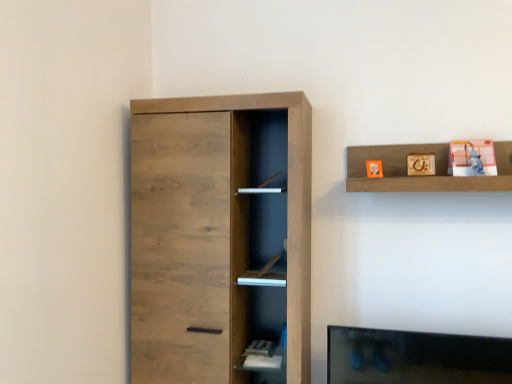
What do you see at coordinates (422, 176) in the screenshot? This screenshot has height=384, width=512. I see `wooden shelf at upper right` at bounding box center [422, 176].

You are a GUI agent. You are given a task and a screenshot of the screen. Output one action in this format:
    pyautogui.click(x=<x>, y=<y>)
    Task: Click on the natural wood cupboard at left
    This screenshot has height=384, width=512.
    Given the screenshot: What is the action you would take?
    pyautogui.click(x=209, y=236)

Is there a large distance between wooden shelf at upper right and matte plastic photo frame at upper right, positioned as the second toy in left-to-right order?

No, wooden shelf at upper right is in close proximity to matte plastic photo frame at upper right, positioned as the second toy in left-to-right order.

Is wooden shelf at upper right facing away from matte plastic photo frame at upper right, positioned as the second toy in left-to-right order?

That's right, wooden shelf at upper right is facing away from matte plastic photo frame at upper right, positioned as the second toy in left-to-right order.

Between wooden shelf at upper right and matte plastic photo frame at upper right, positioned as the second toy in left-to-right order, which one has larger width?

With larger width is wooden shelf at upper right.

Considering the relative sizes of wooden shelf at upper right and matte plastic photo frame at upper right, the first toy when ordered from right to left, in the image provided, is wooden shelf at upper right smaller than matte plastic photo frame at upper right, the first toy when ordered from right to left,?

No, wooden shelf at upper right is not smaller than matte plastic photo frame at upper right, the first toy when ordered from right to left.

From a real-world perspective, is natural wood cupboard at left physically below matte plastic photo frame at upper right, the first toy when ordered from right to left?

Yes, from a real-world perspective, natural wood cupboard at left is below matte plastic photo frame at upper right, the first toy when ordered from right to left.

Is natural wood cupboard at left completely or partially outside of matte plastic photo frame at upper right, the first toy when ordered from right to left?

natural wood cupboard at left lies outside matte plastic photo frame at upper right, the first toy when ordered from right to left,'s area.

Consider the image. Between natural wood cupboard at left and matte plastic photo frame at upper right, positioned as the second toy in left-to-right order, which one appears on the left side from the viewer's perspective?

Positioned to the left is natural wood cupboard at left.

Which object is further away from the camera taking this photo, natural wood cupboard at left or matte plastic photo frame at upper right, positioned as the second toy in left-to-right order?

Positioned behind is matte plastic photo frame at upper right, positioned as the second toy in left-to-right order.

Does matte plastic photo frame at upper right, the first toy when ordered from right to left, touch wooden shelf at upper right?

matte plastic photo frame at upper right, the first toy when ordered from right to left, and wooden shelf at upper right are clearly separated.

Would you say wooden shelf at upper right is part of matte plastic photo frame at upper right, the first toy when ordered from right to left,'s contents?

No, matte plastic photo frame at upper right, the first toy when ordered from right to left, does not contain wooden shelf at upper right.

Between matte plastic photo frame at upper right, positioned as the second toy in left-to-right order, and wooden shelf at upper right, which one has less height?

With less height is matte plastic photo frame at upper right, positioned as the second toy in left-to-right order.

From a real-world perspective, is matte plastic photo frame at upper right, the first toy when ordered from right to left, beneath wooden shelf at upper right?

No.

Is matte orange cube at upper center, arranged as the first toy when viewed from the left, inside or outside of matte plastic photo frame at upper right, positioned as the second toy in left-to-right order?

matte orange cube at upper center, arranged as the first toy when viewed from the left, lies outside matte plastic photo frame at upper right, positioned as the second toy in left-to-right order.

In the image, is matte orange cube at upper center, which is the second toy in right-to-left order, on the left side or the right side of matte plastic photo frame at upper right, positioned as the second toy in left-to-right order?

matte orange cube at upper center, which is the second toy in right-to-left order, is positioned on matte plastic photo frame at upper right, positioned as the second toy in left-to-right order,'s left side.

From the image's perspective, would you say matte orange cube at upper center, which is the second toy in right-to-left order, is positioned over matte plastic photo frame at upper right, the first toy when ordered from right to left?

No.

In the scene shown: Is matte orange cube at upper center, which is the second toy in right-to-left order, inside the boundaries of wooden shelf at upper right, or outside?

matte orange cube at upper center, which is the second toy in right-to-left order, is spatially positioned inside wooden shelf at upper right.

Which point is more forward, (379,165) or (394,166)?

Positioned in front is point (379,165).

From a real-world perspective, is matte orange cube at upper center, arranged as the first toy when viewed from the left, positioned over wooden shelf at upper right based on gravity?

No, from a real-world perspective, matte orange cube at upper center, arranged as the first toy when viewed from the left, is not above wooden shelf at upper right.

Which of these two, matte orange cube at upper center, arranged as the first toy when viewed from the left, or wooden shelf at upper right, is wider?

With larger width is wooden shelf at upper right.

The height and width of the screenshot is (384, 512). In order to click on shelf above the natural wood cupboard at left (from the image's perspective) in this screenshot , I will do `click(422, 176)`.

Considering the sizes of objects wooden shelf at upper right and natural wood cupboard at left in the image provided, who is smaller, wooden shelf at upper right or natural wood cupboard at left?

wooden shelf at upper right is smaller.

Can you tell me how much wooden shelf at upper right and natural wood cupboard at left differ in facing direction?

1.41 degrees.

Can you confirm if wooden shelf at upper right is shorter than natural wood cupboard at left?

Yes.

Who is smaller, wooden shelf at upper right or matte orange cube at upper center, which is the second toy in right-to-left order?

matte orange cube at upper center, which is the second toy in right-to-left order.

Who is taller, wooden shelf at upper right or matte orange cube at upper center, arranged as the first toy when viewed from the left?

With more height is wooden shelf at upper right.

Is wooden shelf at upper right touching matte orange cube at upper center, which is the second toy in right-to-left order?

No, wooden shelf at upper right is not beside matte orange cube at upper center, which is the second toy in right-to-left order.

Image resolution: width=512 pixels, height=384 pixels. In order to click on toy above the wooden shelf at upper right (from a real-world perspective) in this screenshot , I will do `click(472, 158)`.

In the image, there is a matte plastic photo frame at upper right, positioned as the second toy in left-to-right order. Where is `cupboard below it (from the image's perspective)`? cupboard below it (from the image's perspective) is located at coordinates (209, 236).

Looking at the image, which one is located closer to matte orange cube at upper center, which is the second toy in right-to-left order, natural wood cupboard at left or wooden shelf at upper right?

wooden shelf at upper right is positioned closer to the anchor matte orange cube at upper center, which is the second toy in right-to-left order.

Looking at the image, which one is located further to natural wood cupboard at left, matte plastic photo frame at upper right, positioned as the second toy in left-to-right order, or wooden shelf at upper right?

Among the two, matte plastic photo frame at upper right, positioned as the second toy in left-to-right order, is located further to natural wood cupboard at left.

When comparing their distances from matte orange cube at upper center, which is the second toy in right-to-left order, does natural wood cupboard at left or matte plastic photo frame at upper right, the first toy when ordered from right to left, seem further?

natural wood cupboard at left lies further to matte orange cube at upper center, which is the second toy in right-to-left order, than the other object.

Which object lies further to the anchor point natural wood cupboard at left, matte orange cube at upper center, which is the second toy in right-to-left order, or wooden shelf at upper right?

matte orange cube at upper center, which is the second toy in right-to-left order, is positioned further to the anchor natural wood cupboard at left.

Looking at the image, which one is located further to matte orange cube at upper center, which is the second toy in right-to-left order, wooden shelf at upper right or matte plastic photo frame at upper right, positioned as the second toy in left-to-right order?

matte plastic photo frame at upper right, positioned as the second toy in left-to-right order.

Estimate the real-world distances between objects in this image. Which object is closer to wooden shelf at upper right, natural wood cupboard at left or matte orange cube at upper center, which is the second toy in right-to-left order?

matte orange cube at upper center, which is the second toy in right-to-left order.

Based on their spatial positions, is matte orange cube at upper center, arranged as the first toy when viewed from the left, or natural wood cupboard at left further from wooden shelf at upper right?

natural wood cupboard at left lies further to wooden shelf at upper right than the other object.

Considering their positions, is matte plastic photo frame at upper right, positioned as the second toy in left-to-right order, positioned further to natural wood cupboard at left than matte orange cube at upper center, which is the second toy in right-to-left order?

matte plastic photo frame at upper right, positioned as the second toy in left-to-right order.

I want to click on toy between natural wood cupboard at left and matte plastic photo frame at upper right, positioned as the second toy in left-to-right order, so click(374, 169).

Locate an element on the screen. shelf between matte orange cube at upper center, which is the second toy in right-to-left order, and matte plastic photo frame at upper right, positioned as the second toy in left-to-right order, from left to right is located at coordinates click(422, 176).

This screenshot has width=512, height=384. In order to click on shelf situated between natural wood cupboard at left and matte plastic photo frame at upper right, the first toy when ordered from right to left, from left to right in this screenshot , I will do 422,176.

Locate an element on the screen. The image size is (512, 384). toy situated between natural wood cupboard at left and wooden shelf at upper right from left to right is located at coordinates (374, 169).